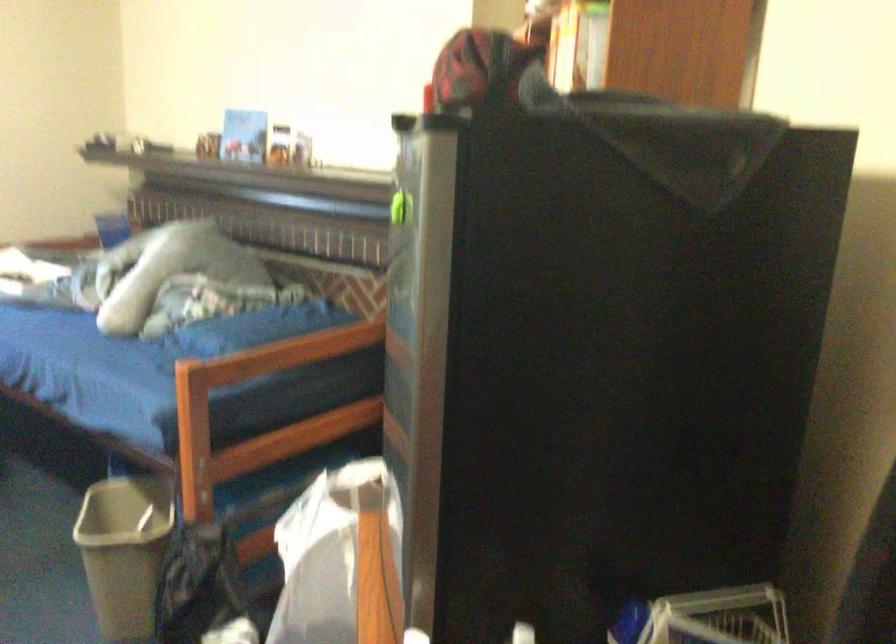
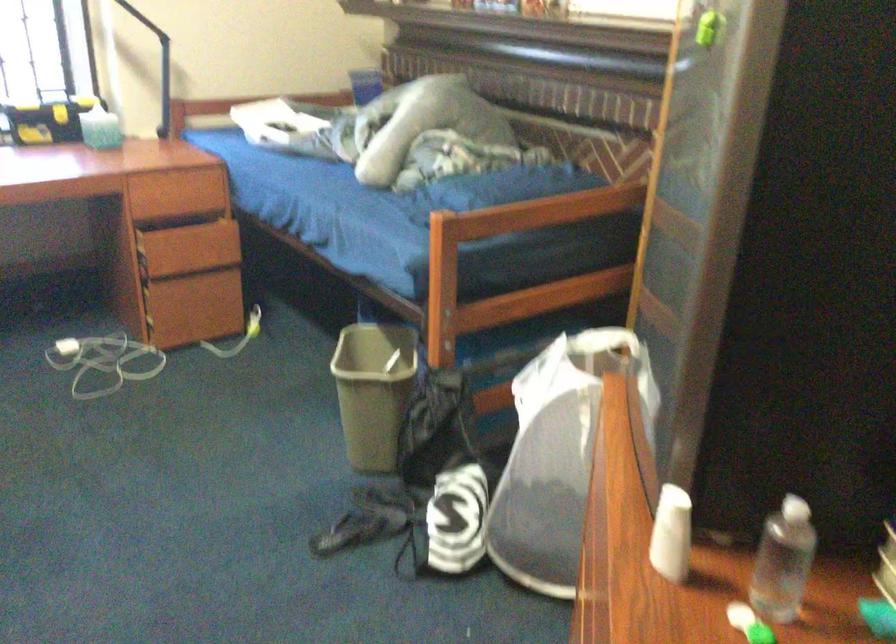
Question: Based on the continuous images, in which direction is the camera rotating? Reply with the corresponding letter.

Choices:
 (A) Left
 (B) Right
 (C) Up
 (D) Down

Answer: (A)